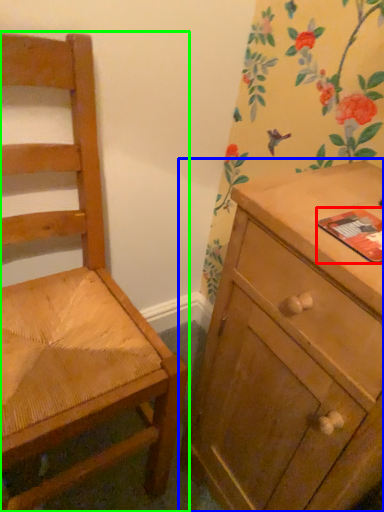
Question: Considering the real-world distances, which object is farthest from paperback book (highlighted by a red box)? chest of drawers (highlighted by a blue box) or chair (highlighted by a green box)?

Choices:
 (A) chest of drawers
 (B) chair

Answer: (B)